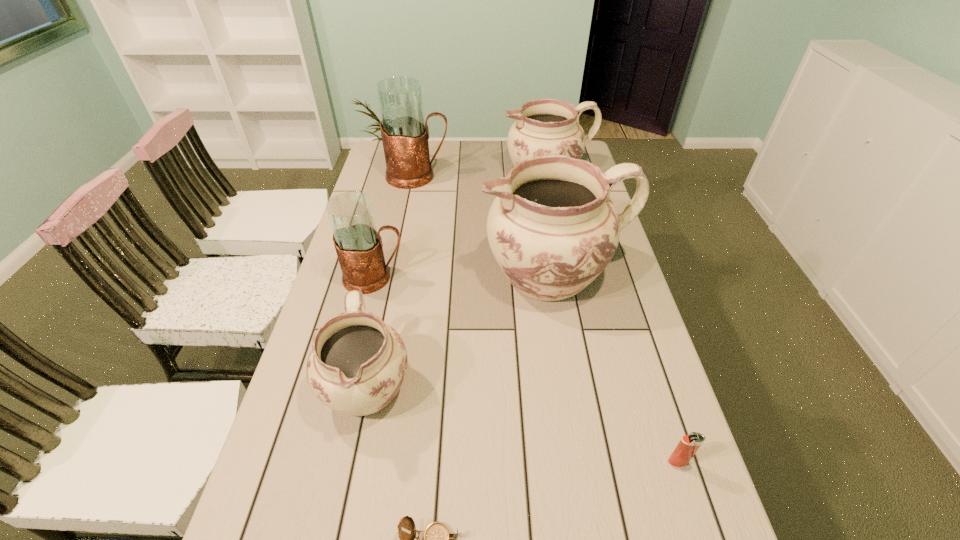
Locate an element on the screen. Image resolution: width=960 pixels, height=540 pixels. vacant area situated 0.070m on the spout of the second nearest purple pitcher is located at coordinates (457, 275).

I want to click on free space located 0.270m on the spout of the second nearest purple pitcher, so click(392, 275).

Identify the location of free spot located on the spout of the second smallest purple pitcher. (434, 176).

This screenshot has height=540, width=960. What are the coordinates of `free location located on the spout of the second smallest purple pitcher` in the screenshot? It's located at (462, 176).

Where is `vacant space located 0.230m on the spout of the second smallest purple pitcher`? vacant space located 0.230m on the spout of the second smallest purple pitcher is located at coordinates (444, 176).

What are the coordinates of `vacant space located 0.310m with the handle on the side of the nearer gray pitcher` in the screenshot? It's located at pyautogui.click(x=508, y=278).

Locate an element on the screen. This screenshot has height=540, width=960. vacant space positioned on the spout of the smallest purple pitcher is located at coordinates (342, 511).

This screenshot has height=540, width=960. I want to click on vacant space situated on the back of the sixth farthest object, so click(x=631, y=315).

Identify the location of igniter present at the right edge. pos(689,444).

At what (x,y) coordinates should I click in order to perform the action: click on object located at the far left corner. Please return your answer as a coordinate pair (x, y). Looking at the image, I should click on (405, 133).